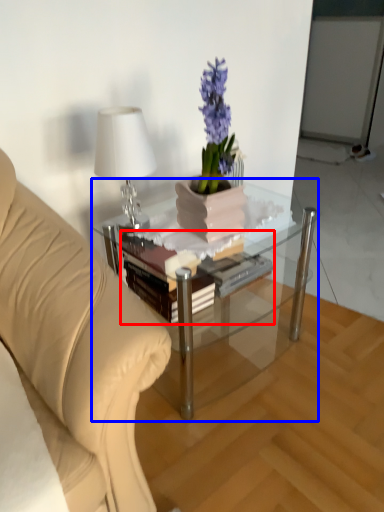
Question: Which of the following is the closest to the observer, book (highlighted by a red box) or coffee table (highlighted by a blue box)?

Choices:
 (A) book
 (B) coffee table

Answer: (B)